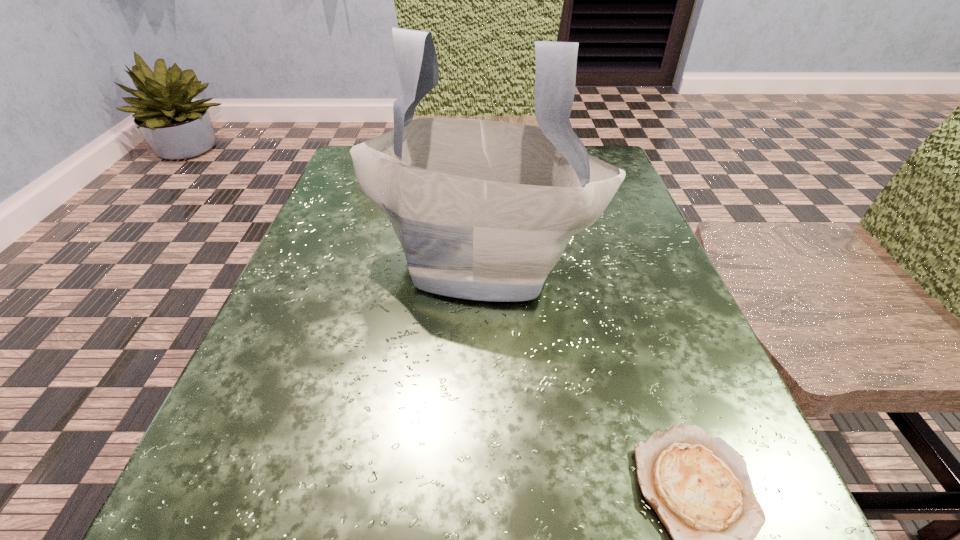
Where is `the farther object`? The width and height of the screenshot is (960, 540). the farther object is located at coordinates (483, 210).

Image resolution: width=960 pixels, height=540 pixels. What are the coordinates of `shopping bag` in the screenshot? It's located at (483, 210).

The width and height of the screenshot is (960, 540). Identify the location of free location located on the back of the farther object. (481, 173).

You are a GUI agent. You are given a task and a screenshot of the screen. Output one action in this format:
    pyautogui.click(x=<x>, y=<y>)
    Task: Click on the object at the left edge
    This screenshot has height=540, width=960.
    Given the screenshot: What is the action you would take?
    pyautogui.click(x=483, y=210)

This screenshot has height=540, width=960. I want to click on object that is at the right edge, so click(x=483, y=210).

The image size is (960, 540). What are the coordinates of `vacant space at the near edge of the desktop` in the screenshot? It's located at (379, 491).

Locate an element on the screen. free space at the left edge of the desktop is located at coordinates (282, 398).

In the image, there is a desktop. At what (x,y) coordinates should I click in order to perform the action: click on vacant space at the right edge. Please return your answer as a coordinate pair (x, y). This screenshot has width=960, height=540. Looking at the image, I should click on (698, 342).